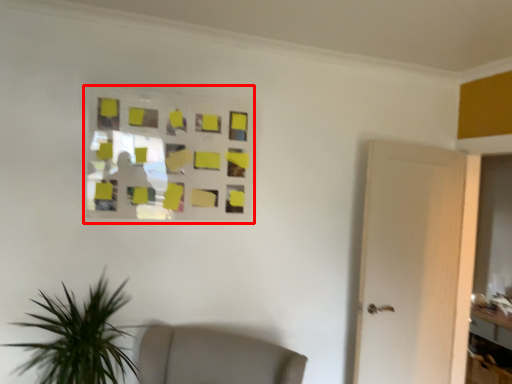
Question: Observing the image, what is the correct spatial positioning of glass window (annotated by the red box) in reference to table?

Choices:
 (A) left
 (B) right

Answer: (A)